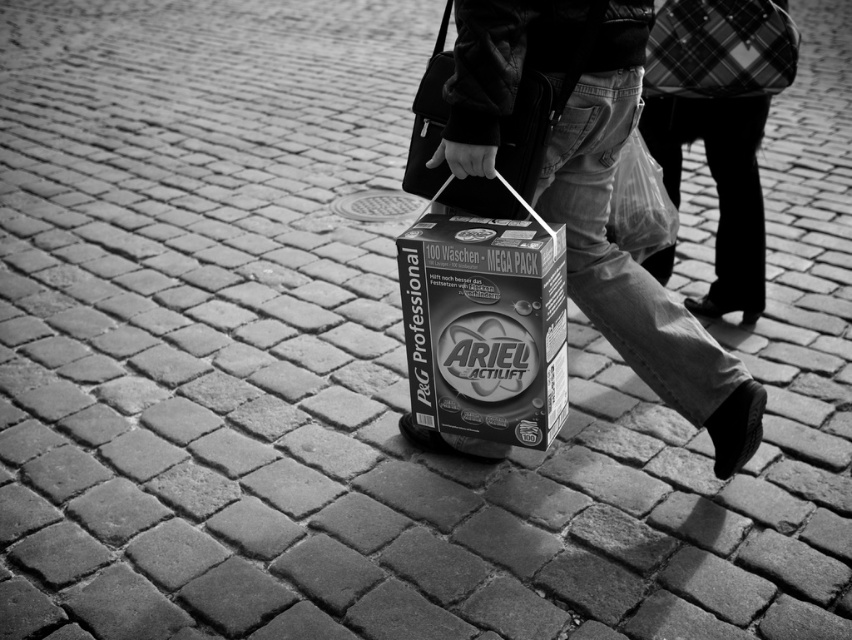
The width and height of the screenshot is (852, 640). What do you see at coordinates (629, 253) in the screenshot?
I see `matte cardboard box at center` at bounding box center [629, 253].

At what (x,y) coordinates should I click in order to perform the action: click on matte cardboard box at center. Please return your answer as a coordinate pair (x, y). The width and height of the screenshot is (852, 640). Looking at the image, I should click on (629, 253).

Can you confirm if plaid fabric bag at upper right is positioned above transparent plastic bag at center?

Yes, plaid fabric bag at upper right is above transparent plastic bag at center.

Identify the location of plaid fabric bag at upper right. click(x=718, y=49).

What do you see at coordinates (718, 49) in the screenshot? I see `plaid fabric bag at upper right` at bounding box center [718, 49].

This screenshot has height=640, width=852. Identify the location of plaid fabric bag at upper right. (718, 49).

Is matte cardboard box at center in front of plaid fabric bag at center?

That is True.

Can you confirm if matte cardboard box at center is taller than plaid fabric bag at center?

Yes.

Does point (619, 276) lie behind point (752, 132)?

No.

Where is `matte cardboard box at center`? The image size is (852, 640). matte cardboard box at center is located at coordinates (629, 253).